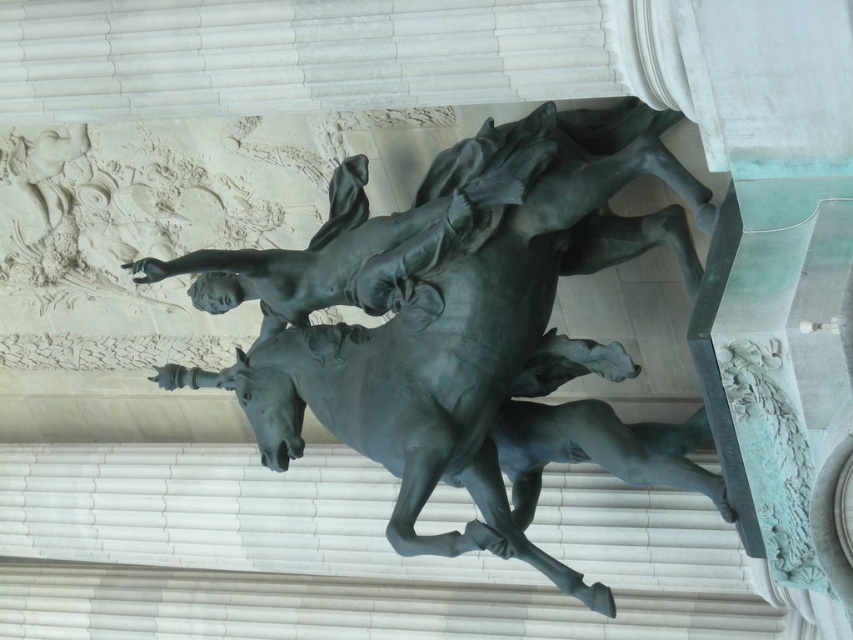
You are an art student standing in front of the classical building with fluted columns. You want to sketch the bronze statue at center. Where should you position yourself to capture the statue in the best possible perspective?

The bronze statue at center is located at point (463, 324), so you should position yourself directly in front of the statue to capture it in the best possible perspective.

You are standing in front of the classical building and see two bronze statues. Which one is closer to you, the bronze statue at center or the bronze statue at upper center?

The bronze statue at center is closer to you because it is further to the viewer than the bronze statue at upper center.

In the scene shown: You are standing in front of a classical building with columns. There is a bronze statue at center. Can you tell me the location of the bronze statue at center relative to the point with coordinates (x=463, y=324)?

The bronze statue at center is located exactly at the point with coordinates (x=463, y=324).